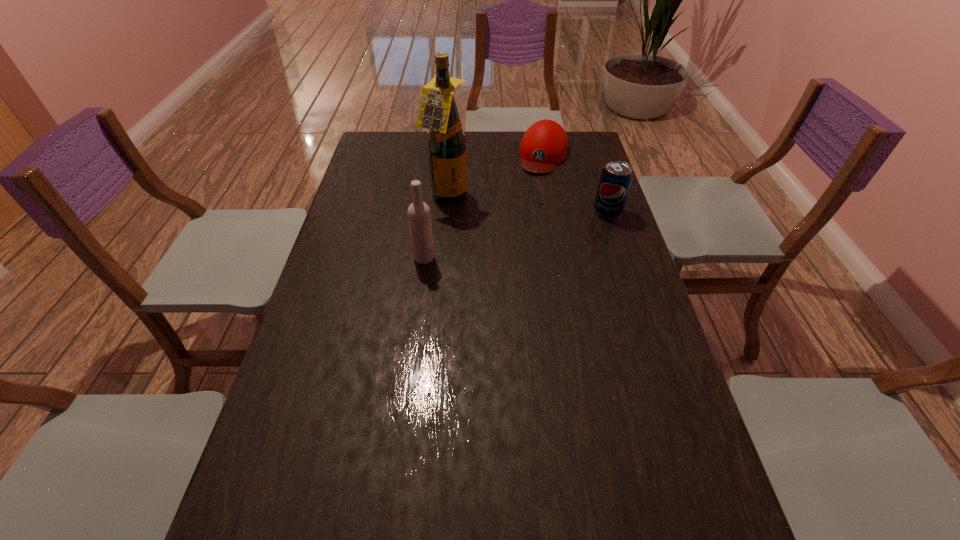
Where is `vacant spot on the desktop that is between the nearest object and the soda can and is positioned on the front-facing side of the tallest object`? vacant spot on the desktop that is between the nearest object and the soda can and is positioned on the front-facing side of the tallest object is located at coordinates (510, 237).

At what (x,y) coordinates should I click in order to perform the action: click on free space on the desktop that is between the second tallest object and the third tallest object and is positioned on the front-facing side of the second object from right to left. Please return your answer as a coordinate pair (x, y). This screenshot has height=540, width=960. Looking at the image, I should click on (516, 235).